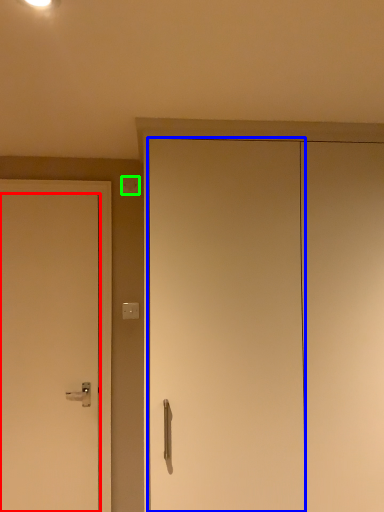
Question: Which object is positioned closest to door (highlighted by a red box)? Select from door (highlighted by a blue box) and light switch (highlighted by a green box).

Choices:
 (A) door
 (B) light switch

Answer: (A)